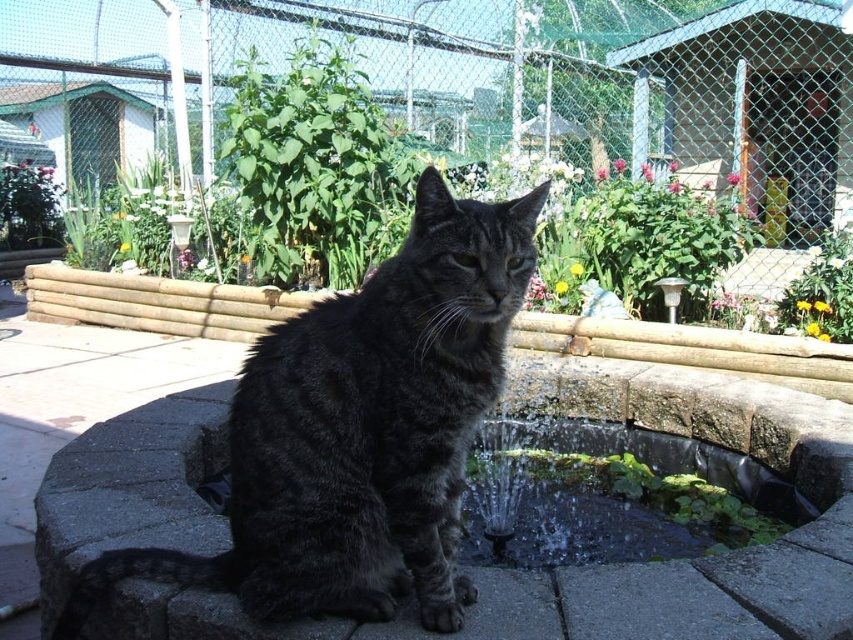
Question: Can you confirm if dark gray fur cat at center is smaller than smooth stone fountain at center?

Choices:
 (A) no
 (B) yes

Answer: (B)

Question: Among these points, which one is farthest from the camera?

Choices:
 (A) (253, 353)
 (B) (558, 396)

Answer: (B)

Question: Is dark gray fur cat at center below smooth stone fountain at center?

Choices:
 (A) yes
 (B) no

Answer: (B)

Question: Does dark gray fur cat at center have a greater width compared to smooth stone fountain at center?

Choices:
 (A) no
 (B) yes

Answer: (A)

Question: Which point is farther from the camera taking this photo?

Choices:
 (A) (129, 416)
 (B) (471, 260)

Answer: (A)